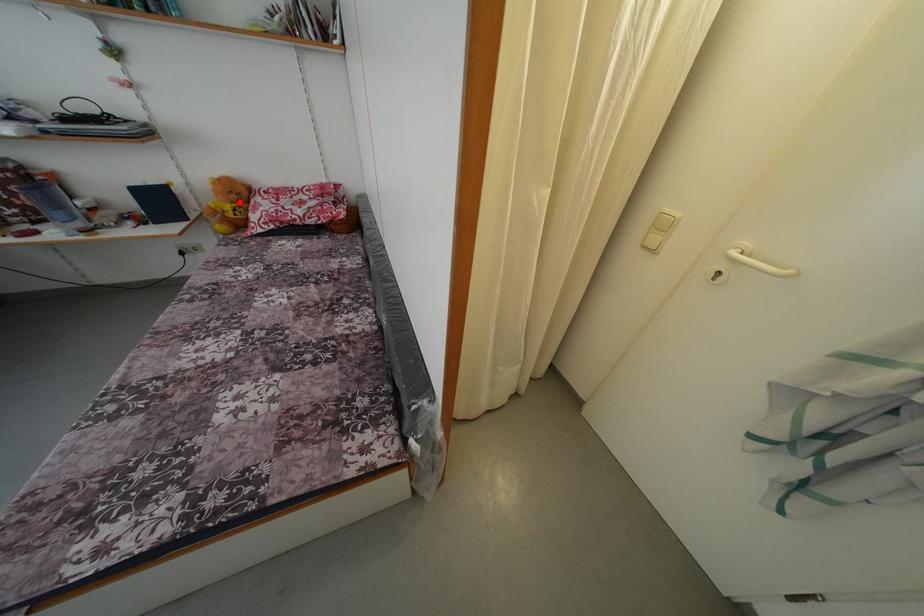
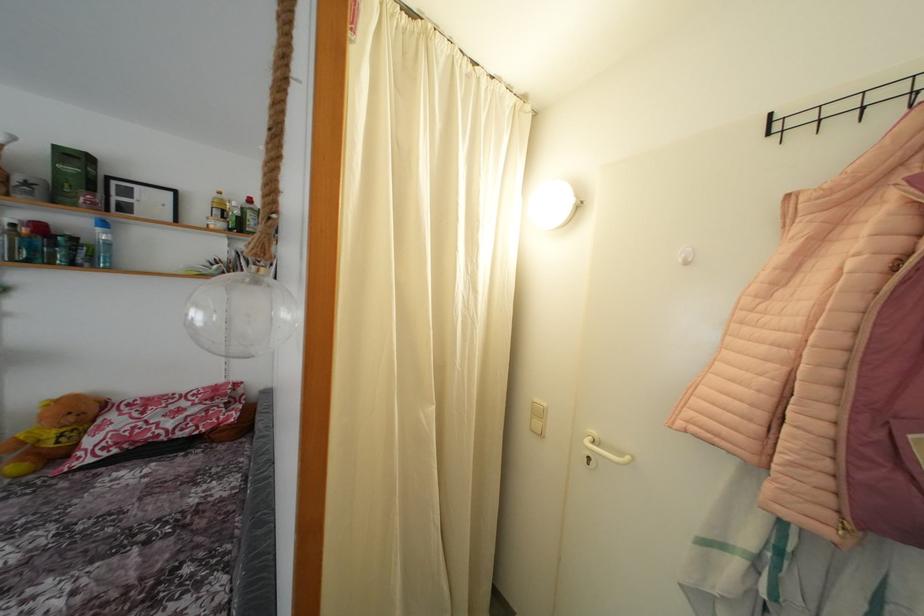
Where in the second image is the point corresponding to the highlighted location from the first image?

(77, 424)